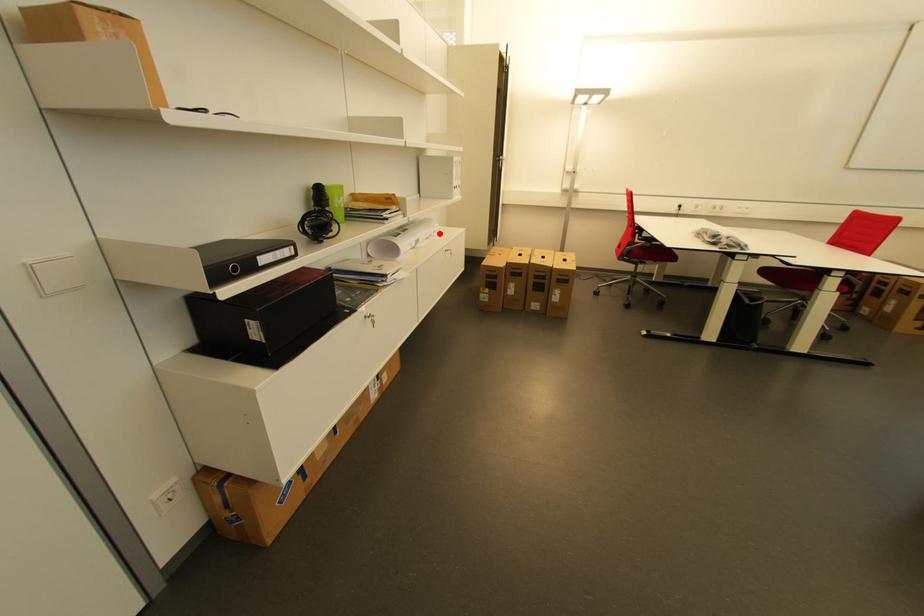
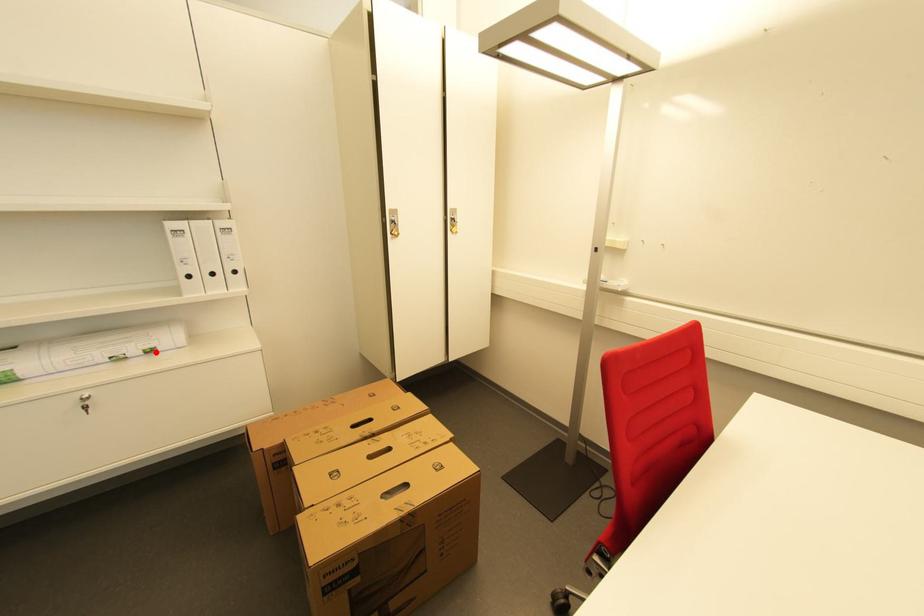
I am providing you with two images of the same scene from different viewpoints. A red point is marked on the first image and another point is marked on the second image. Is the marked point in image1 the same physical position as the marked point in image2?

Yes